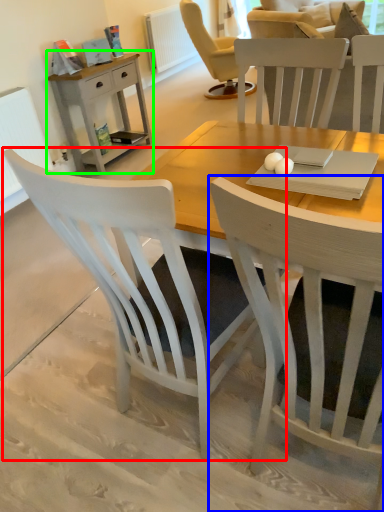
Question: Estimate the real-world distances between objects in this image. Which object is farther from chair (highlighted by a red box), chair (highlighted by a blue box) or nightstand (highlighted by a green box)?

Choices:
 (A) chair
 (B) nightstand

Answer: (B)